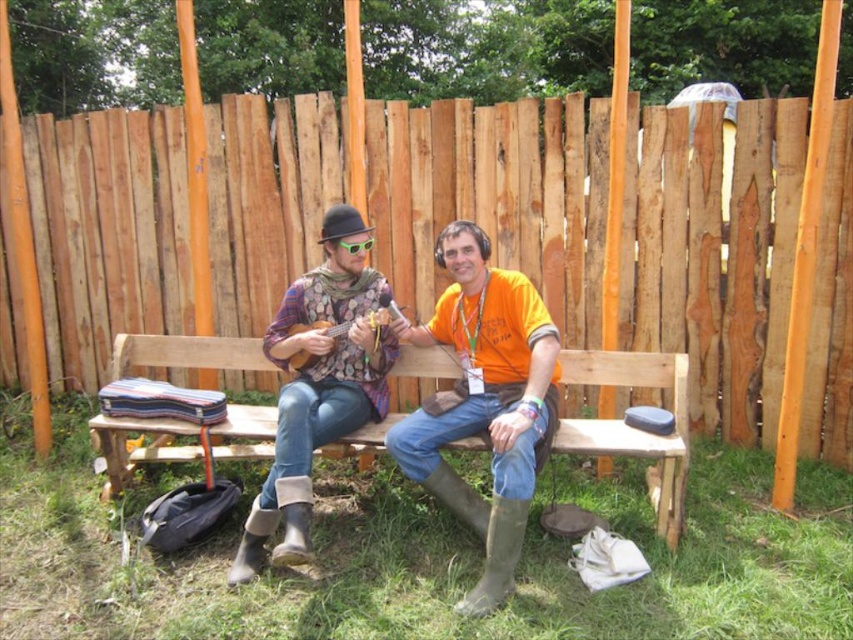
Question: Which object is farther from the camera taking this photo?

Choices:
 (A) wooden bench at center
 (B) matte orange t-shirt at center
 (C) green plastic goggles at center

Answer: (C)

Question: Does wooden fence at center appear over wooden ukulele at center?

Choices:
 (A) no
 (B) yes

Answer: (B)

Question: Does wooden bench at center appear on the right side of flannel shirt at center?

Choices:
 (A) yes
 (B) no

Answer: (A)

Question: Among these objects, which one is nearest to the camera?

Choices:
 (A) flannel shirt at center
 (B) wooden bench at center
 (C) matte orange t-shirt at center
 (D) wooden fence at center

Answer: (C)

Question: Can you confirm if wooden fence at center is wider than wooden bench at center?

Choices:
 (A) yes
 (B) no

Answer: (A)

Question: Which point is closer to the camera?

Choices:
 (A) (115, 349)
 (B) (318, 328)

Answer: (B)